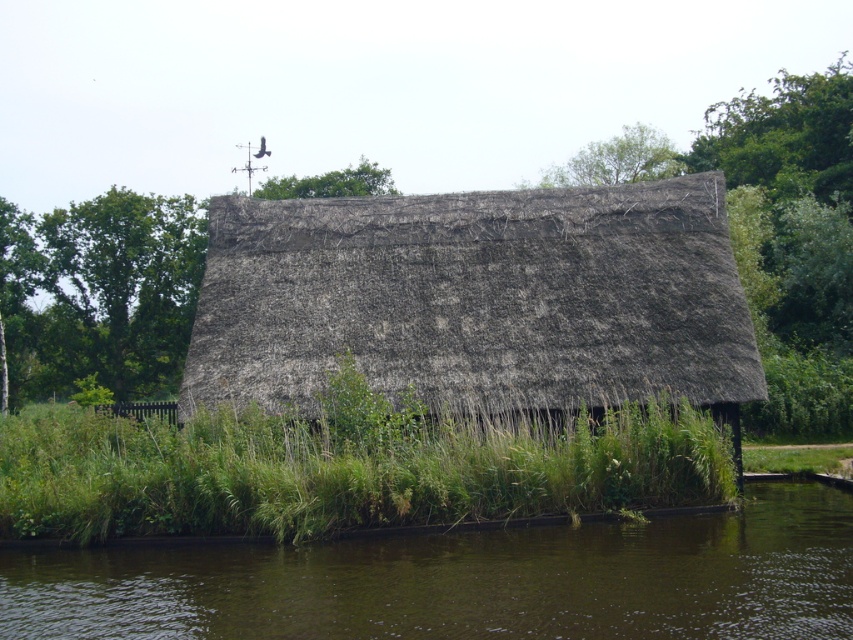
Can you confirm if brown thatch roof at center is smaller than brown murky water at lower center?

Incorrect, brown thatch roof at center is not smaller in size than brown murky water at lower center.

Does brown thatch roof at center appear on the left side of brown murky water at lower center?

In fact, brown thatch roof at center is to the right of brown murky water at lower center.

Between point (194, 397) and point (48, 625), which one is positioned behind?

Point (194, 397)

The image size is (853, 640). Find the location of `brown thatch roof at center`. brown thatch roof at center is located at coordinates click(x=476, y=300).

Looking at this image, is brown thatch roof at center below green grass at lower center?

No, brown thatch roof at center is not below green grass at lower center.

Does brown thatch roof at center come in front of green grass at lower center?

No, brown thatch roof at center is further to the viewer.

At what (x,y) coordinates should I click in order to perform the action: click on brown thatch roof at center. Please return your answer as a coordinate pair (x, y). This screenshot has height=640, width=853. Looking at the image, I should click on (476, 300).

Which of these two, brown murky water at lower center or green grass at lower center, stands shorter?

With less height is brown murky water at lower center.

Is point (100, 552) positioned before point (50, 513)?

Yes, point (100, 552) is closer to viewer.

Locate an element on the screen. Image resolution: width=853 pixels, height=640 pixels. brown murky water at lower center is located at coordinates (467, 580).